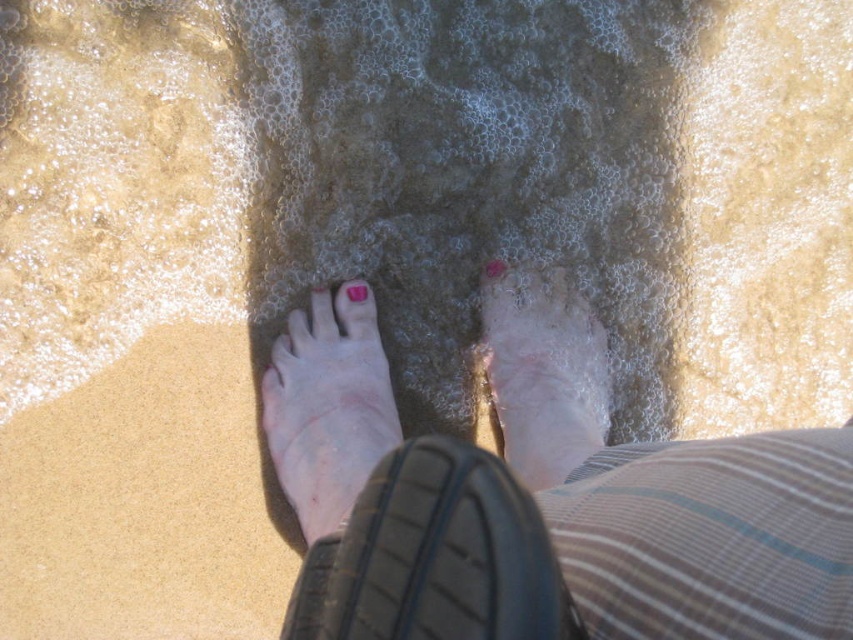
You are a photographer capturing the scene of a person on a beach. You need to ensure both the pale skin foot at center and the pink matte nail polish at center are visible in your shot. Based on their positions, which object should be placed closer to the left side of the frame?

The pale skin foot at center should be placed closer to the left side of the frame since it is positioned to the left of the pink matte nail polish at center.